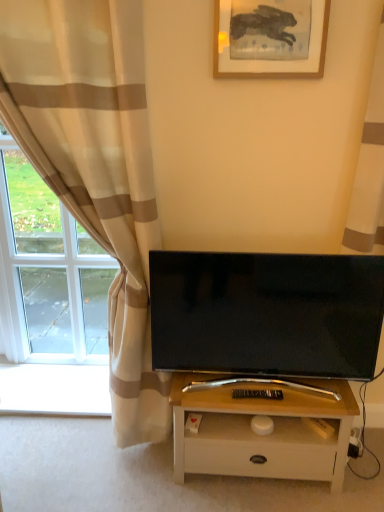
Locate an element on the screen. The height and width of the screenshot is (512, 384). vacant area situated below beige striped curtain at left, acting as the 2th curtain starting from the right (from a real-world perspective) is located at coordinates (69, 434).